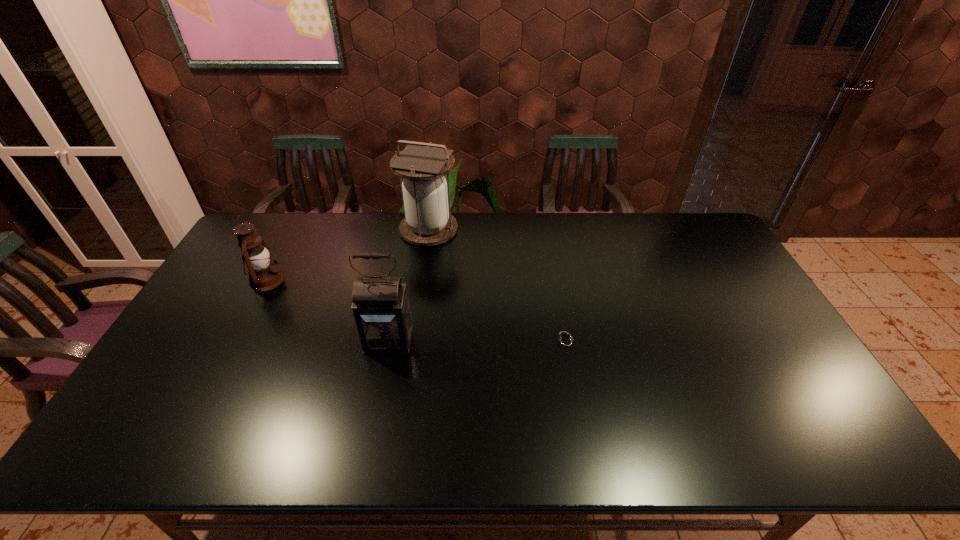
You are a GUI agent. You are given a task and a screenshot of the screen. Output one action in this format:
    pyautogui.click(x=<x>, y=<y>)
    Task: Click on the free spot between the nearest lantern and the second nearest lantern
    This screenshot has height=540, width=960.
    Given the screenshot: What is the action you would take?
    pyautogui.click(x=328, y=310)

At what (x,y) coordinates should I click in order to perform the action: click on free space between the farthest object and the rightmost object. Please return your answer as a coordinate pair (x, y). This screenshot has width=960, height=540. Looking at the image, I should click on (497, 286).

Image resolution: width=960 pixels, height=540 pixels. What are the coordinates of `vacant region between the farthest lantern and the leftmost object` in the screenshot? It's located at (348, 254).

You are a GUI agent. You are given a task and a screenshot of the screen. Output one action in this format:
    pyautogui.click(x=<x>, y=<y>)
    Task: Click on the free space between the nearest lantern and the farthest object
    The image size is (960, 540).
    Given the screenshot: What is the action you would take?
    pyautogui.click(x=409, y=285)

You are a GUI agent. You are given a task and a screenshot of the screen. Output one action in this format:
    pyautogui.click(x=<x>, y=<y>)
    Task: Click on the vacant space that's between the nearest lantern and the leftmost object
    The height and width of the screenshot is (540, 960).
    Given the screenshot: What is the action you would take?
    pyautogui.click(x=328, y=310)

Identify the location of free space between the shortest object and the nearest lantern. This screenshot has height=540, width=960. (477, 342).

Where is `empty location between the shortest object and the nearest lantern`? The height and width of the screenshot is (540, 960). empty location between the shortest object and the nearest lantern is located at coordinates (477, 342).

This screenshot has width=960, height=540. I want to click on unoccupied position between the leftmost lantern and the farthest lantern, so click(x=348, y=254).

Select which object is the closest to the shortest object. Please provide its 2D coordinates. Your answer should be formatted as a tuple, i.e. [(x, y)], where the tuple contains the x and y coordinates of a point satisfying the conditions above.

[(381, 309)]

Find the location of a particular element. This screenshot has height=540, width=960. object that stands as the closest to the watch is located at coordinates (381, 309).